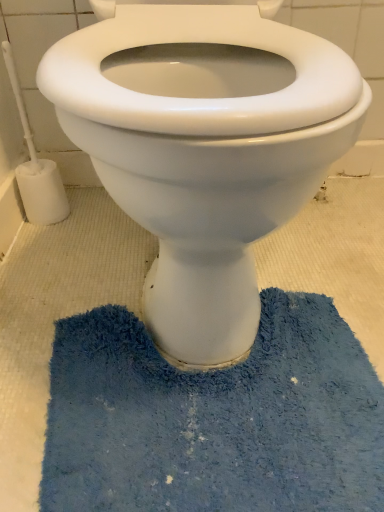
Question: Is blue shaggy bath mat at lower center far away from white plastic toilet brush at left?

Choices:
 (A) yes
 (B) no

Answer: (B)

Question: Can you confirm if blue shaggy bath mat at lower center is shorter than white plastic toilet brush at left?

Choices:
 (A) yes
 (B) no

Answer: (A)

Question: Is blue shaggy bath mat at lower center looking in the opposite direction of white plastic toilet brush at left?

Choices:
 (A) no
 (B) yes

Answer: (A)

Question: Does blue shaggy bath mat at lower center have a lesser width compared to white plastic toilet brush at left?

Choices:
 (A) yes
 (B) no

Answer: (B)

Question: From the image's perspective, is blue shaggy bath mat at lower center over white plastic toilet brush at left?

Choices:
 (A) no
 (B) yes

Answer: (A)

Question: Is white plastic toilet brush at left completely or partially inside blue shaggy bath mat at lower center?

Choices:
 (A) no
 (B) yes

Answer: (A)

Question: Considering the relative positions of white glossy toilet at center and white plastic toilet brush at left in the image provided, is white glossy toilet at center to the left of white plastic toilet brush at left from the viewer's perspective?

Choices:
 (A) no
 (B) yes

Answer: (A)

Question: Does white glossy toilet at center appear on the right side of white plastic toilet brush at left?

Choices:
 (A) no
 (B) yes

Answer: (B)

Question: From a real-world perspective, is white glossy toilet at center on white plastic toilet brush at left?

Choices:
 (A) no
 (B) yes

Answer: (B)

Question: Can you confirm if white glossy toilet at center is taller than white plastic toilet brush at left?

Choices:
 (A) no
 (B) yes

Answer: (B)

Question: Considering the relative sizes of white glossy toilet at center and white plastic toilet brush at left in the image provided, is white glossy toilet at center wider than white plastic toilet brush at left?

Choices:
 (A) no
 (B) yes

Answer: (B)

Question: Is white glossy toilet at center far from white plastic toilet brush at left?

Choices:
 (A) yes
 (B) no

Answer: (B)

Question: Is blue shaggy bath mat at lower center not within white glossy toilet at center?

Choices:
 (A) yes
 (B) no

Answer: (A)